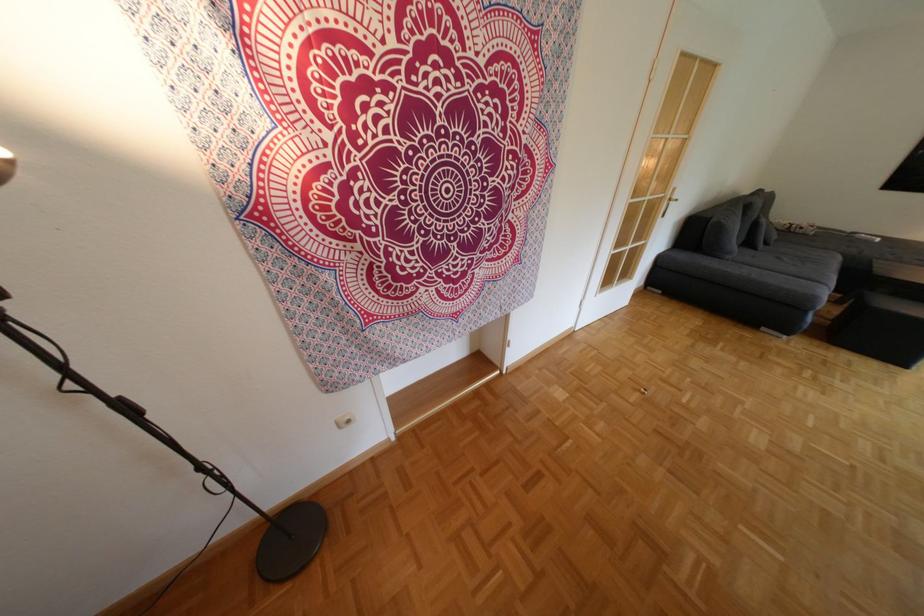
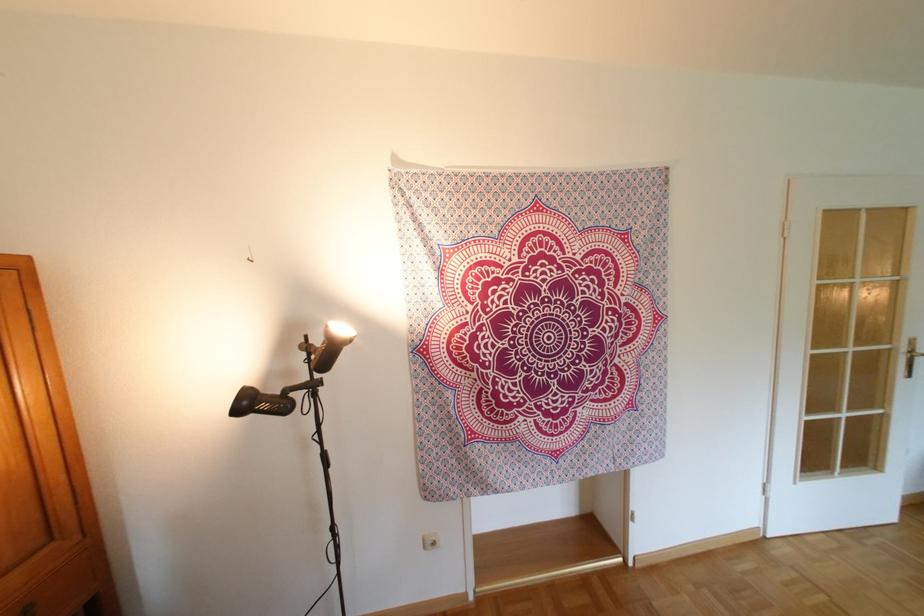
The first image is from the beginning of the video and the second image is from the end. How did the camera likely rotate when shooting the video?

The camera rotated toward left-up.